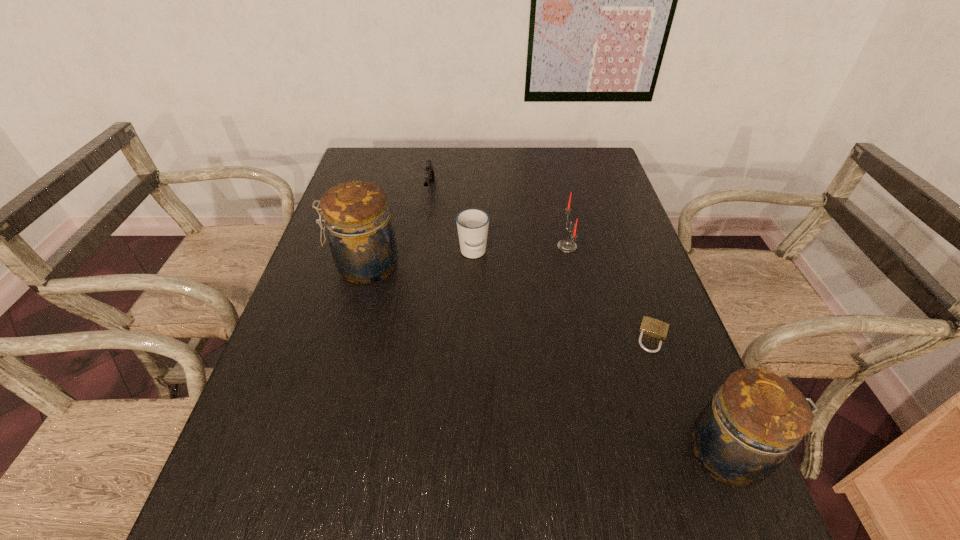
Identify the location of blank area in the image that satisfies the following two spatial constraints: 1. on the lid of the tallest object; 2. on the right side of the padlock. The width and height of the screenshot is (960, 540). (346, 336).

The image size is (960, 540). Identify the location of free region that satisfies the following two spatial constraints: 1. on the lid of the taller jar; 2. on the back side of the shortest object. (346, 336).

This screenshot has width=960, height=540. Find the location of `free spot that satisfies the following two spatial constraints: 1. with a handle on the side of the fourth tallest object; 2. on the right side of the second nearest object`. free spot that satisfies the following two spatial constraints: 1. with a handle on the side of the fourth tallest object; 2. on the right side of the second nearest object is located at coordinates (471, 336).

Locate an element on the screen. The width and height of the screenshot is (960, 540). free location that satisfies the following two spatial constraints: 1. on the lid of the left jar; 2. on the back side of the shortest object is located at coordinates (346, 336).

Where is `vacant space that satisfies the following two spatial constraints: 1. with a handle on the side of the fourth tallest object; 2. on the lid of the tallest object`? vacant space that satisfies the following two spatial constraints: 1. with a handle on the side of the fourth tallest object; 2. on the lid of the tallest object is located at coordinates (473, 266).